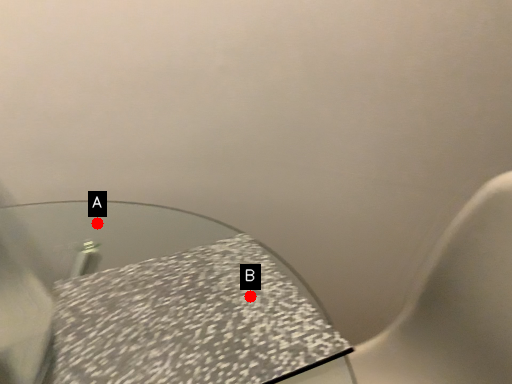
Question: Two points are circled on the image, labeled by A and B beside each circle. Among these points, which one is farthest from the camera?

Choices:
 (A) A is further
 (B) B is further

Answer: (A)